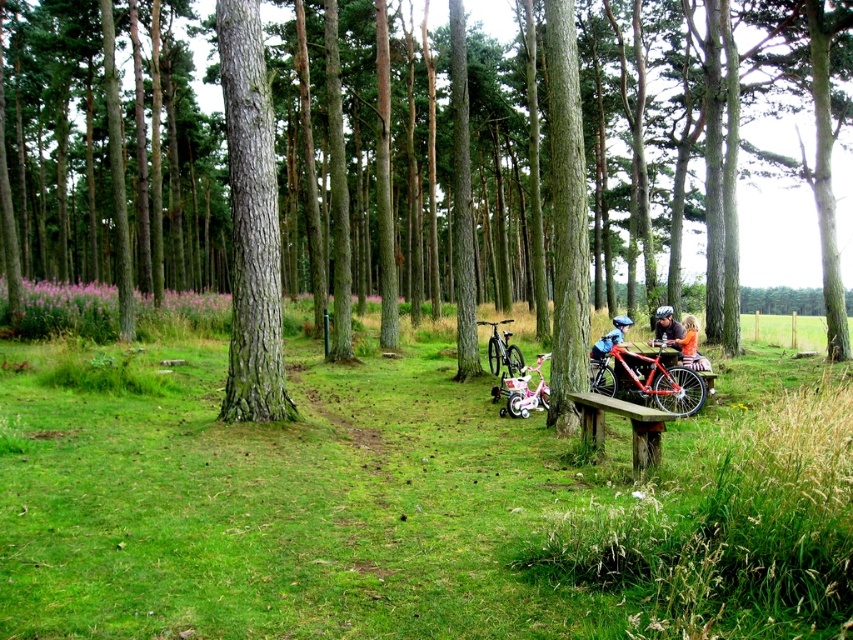
Between metallic bicycle at center and shiny silver mountain bike at center, which one appears on the left side from the viewer's perspective?

From the viewer's perspective, metallic bicycle at center appears more on the left side.

Between point (164, 563) and point (492, 342), which one is positioned in front?

Point (164, 563)

This screenshot has width=853, height=640. What do you see at coordinates (404, 504) in the screenshot? I see `metallic bicycle at center` at bounding box center [404, 504].

The image size is (853, 640). In order to click on metallic bicycle at center in this screenshot , I will do `click(404, 504)`.

In the scene shown: Does smooth brown tree trunk at center lie behind metallic silver bicycle at center?

No, it is not.

Does smooth brown tree trunk at center have a greater height compared to metallic silver bicycle at center?

Yes.

The width and height of the screenshot is (853, 640). Describe the element at coordinates (251, 221) in the screenshot. I see `smooth brown tree trunk at center` at that location.

Find the location of a particular element. smooth brown tree trunk at center is located at coordinates (251, 221).

Between point (625, 404) and point (503, 344), which one is positioned behind?

Positioned behind is point (503, 344).

You are a GUI agent. You are given a task and a screenshot of the screen. Output one action in this format:
    pyautogui.click(x=<x>, y=<y>)
    Task: Click on the wooden bench at lower right
    The height and width of the screenshot is (640, 853).
    Given the screenshot: What is the action you would take?
    pyautogui.click(x=630, y=422)

Where is `wooden bench at lower right`? The height and width of the screenshot is (640, 853). wooden bench at lower right is located at coordinates (630, 422).